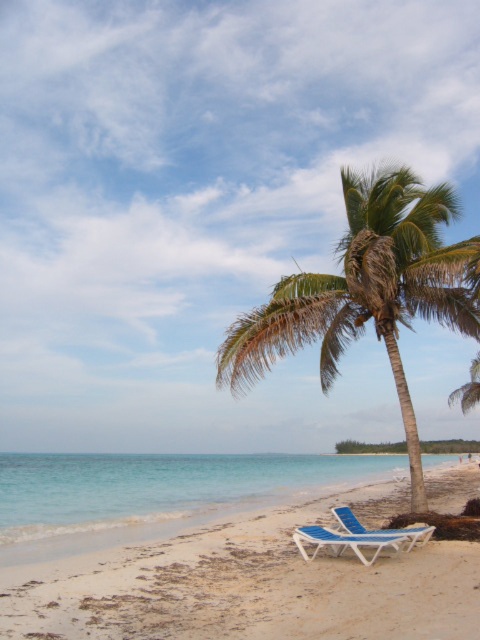
Between white sandy beach at lower center and green leafy palm tree at center, which one is positioned higher?

green leafy palm tree at center is above.

Does white sandy beach at lower center appear on the left side of green leafy palm tree at center?

Yes, white sandy beach at lower center is to the left of green leafy palm tree at center.

Where is `white sandy beach at lower center`? white sandy beach at lower center is located at coordinates (251, 584).

Which is behind, point (382, 337) or point (308, 560)?

Positioned behind is point (382, 337).

Which is in front, point (361, 328) or point (427, 536)?

Positioned in front is point (427, 536).

Locate an element on the screen. The image size is (480, 640). green leafy palm tree at center is located at coordinates (364, 292).

I want to click on green leafy palm tree at center, so click(x=364, y=292).

Does green leafy palm tree at center have a lesser height compared to clear blue water at lower left?

Correct, green leafy palm tree at center is not as tall as clear blue water at lower left.

The image size is (480, 640). What are the coordinates of `green leafy palm tree at center` in the screenshot? It's located at (364, 292).